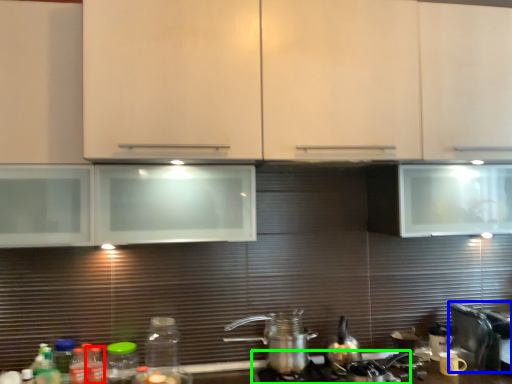
Question: Which object is the farthest from bottle (highlighted by a red box)? Choose among these: appliance (highlighted by a blue box) or gas stove (highlighted by a green box).

Choices:
 (A) appliance
 (B) gas stove

Answer: (A)